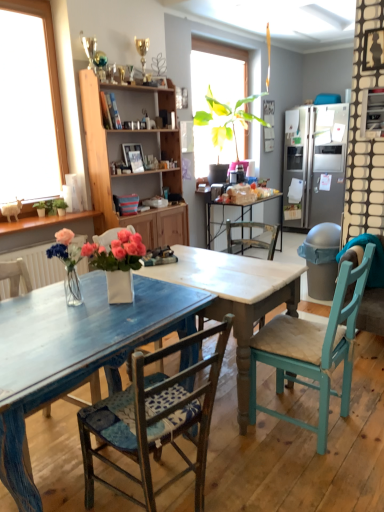
Find the location of a particular element. blank space situated above white marble table at center (from a real-world perspective) is located at coordinates (222, 267).